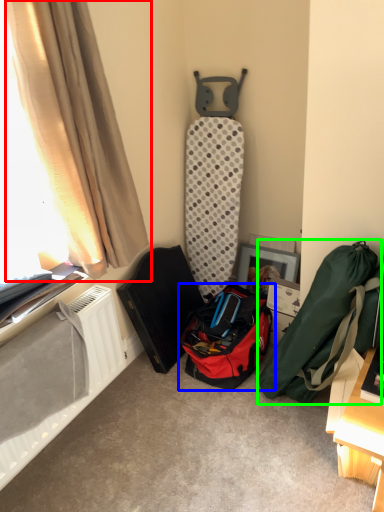
Question: Based on their relative distances, which object is nearer to curtain (highlighted by a red box)? Choose from luggage and bags (highlighted by a blue box) and luggage and bags (highlighted by a green box).

Choices:
 (A) luggage and bags
 (B) luggage and bags

Answer: (A)